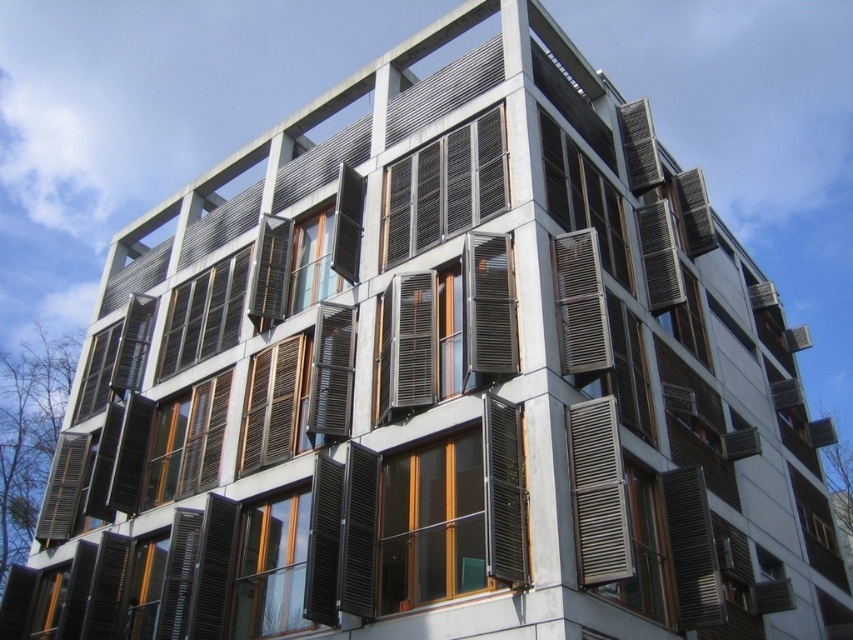
Based on the photo, you are an architect evaluating the building facade. You need to install a new security sensor on the smaller of the two items at the center of the building facade. Which item should you choose between the wooden window at center and the metallic silver shutters at center?

The wooden window at center is larger in size than the metallic silver shutters at center, so the metallic silver shutters at center is the smaller one. You should install the security sensor on the metallic silver shutters at center.

You are an architect analyzing the building facade. You observe the metallic silver shutter at center and the matte black shutter at center. Which shutter is located below the other?

The metallic silver shutter at center is positioned under the matte black shutter at center, meaning it is located below the matte black one.

You are an architect examining the building facade. You notice the brown wooden window at center and the metallic silver shutter at lower right. Which object is closer to you from your current viewpoint?

The brown wooden window at center is closer to you because it is in front of the metallic silver shutter at lower right.